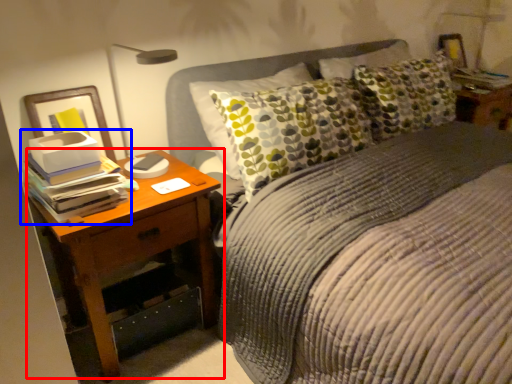
Question: Which object appears farthest to the camera in this image, nightstand (highlighted by a red box) or book (highlighted by a blue box)?

Choices:
 (A) nightstand
 (B) book

Answer: (A)